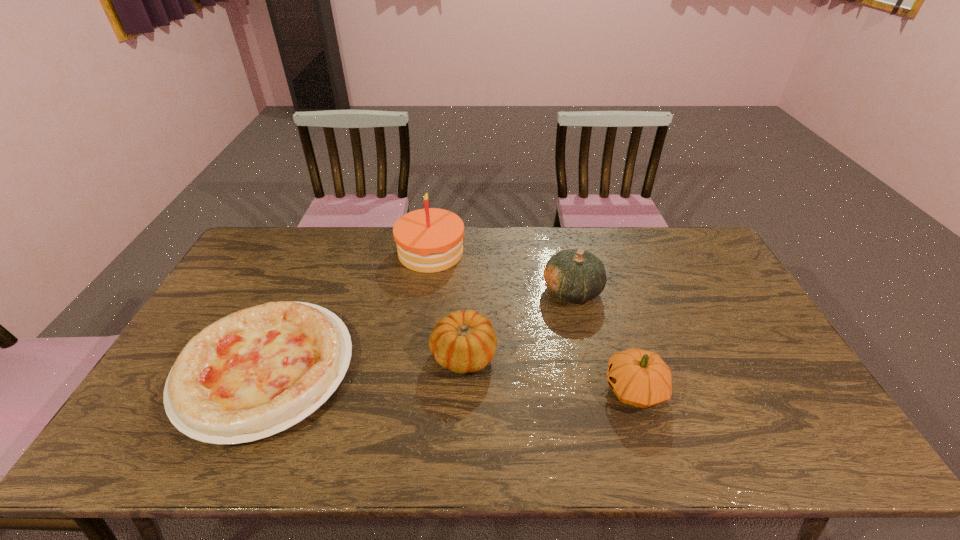
At what (x,y) coordinates should I click in order to perform the action: click on object that is at the near edge. Please return your answer as a coordinate pair (x, y). This screenshot has height=540, width=960. Looking at the image, I should click on (254, 373).

The width and height of the screenshot is (960, 540). Find the location of `object that is positioned at the left edge`. object that is positioned at the left edge is located at coordinates [254, 373].

Find the location of a particular element. This screenshot has height=540, width=960. object located in the near left corner section of the desktop is located at coordinates pos(254,373).

This screenshot has height=540, width=960. Identify the location of vacant space at the far edge. (539, 246).

Image resolution: width=960 pixels, height=540 pixels. In the image, there is a desktop. Identify the location of vacant space at the near edge. (410, 442).

In the image, there is a desktop. Where is `vacant space at the left edge`? This screenshot has width=960, height=540. vacant space at the left edge is located at coordinates (265, 302).

Image resolution: width=960 pixels, height=540 pixels. Identify the location of free region at the far left corner of the desktop. (279, 249).

I want to click on vacant space at the near right corner of the desktop, so click(x=788, y=451).

The image size is (960, 540). I want to click on vacant area that lies between the leftmost gourd and the farthest gourd, so click(x=517, y=322).

The width and height of the screenshot is (960, 540). What are the coordinates of `free space between the shortest object and the leftmost gourd` in the screenshot? It's located at (365, 362).